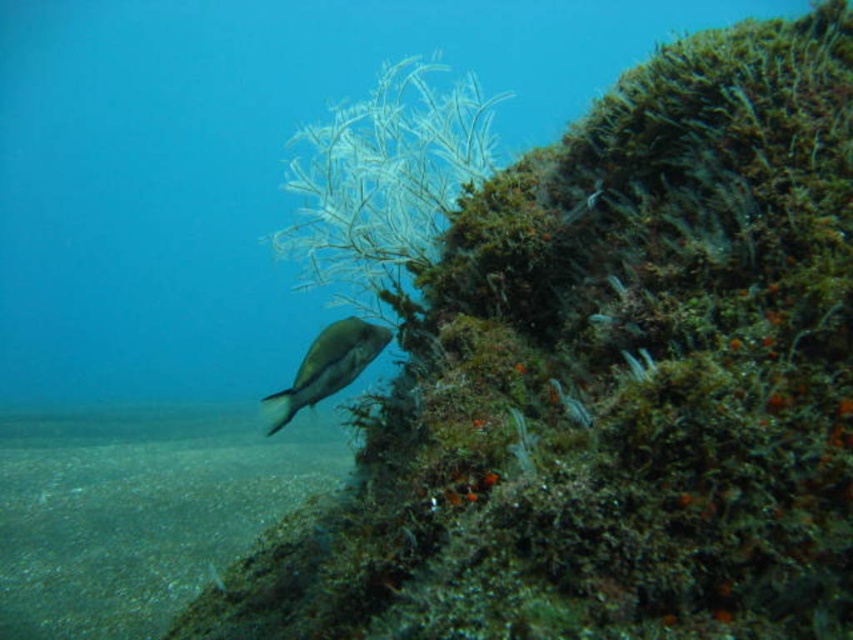
You are a scuba diver who wants to take a photo of the shiny silver fish at center. Since you are at the surface, you need to know if the clear water at bottom will allow enough light for a good photo. Can you confirm?

The clear water at bottom is larger in size than the shiny silver fish at center, but this detail about size does not directly indicate light penetration. However, since the scene describes the water as clear and the image was taken during daylight with good visibility, it is likely sufficient for a good photo.